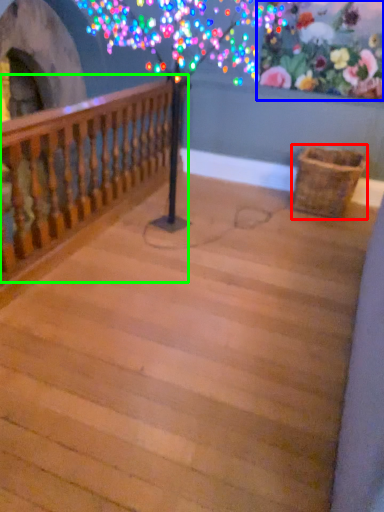
Question: Which object is positioned closest to basket (highlighted by a red box)? Select from floral arrangement (highlighted by a blue box) and rail (highlighted by a green box).

Choices:
 (A) floral arrangement
 (B) rail

Answer: (A)